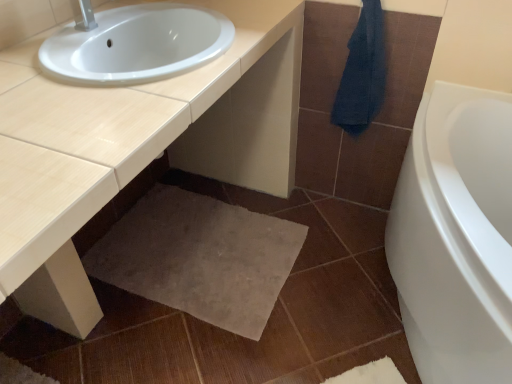
Image resolution: width=512 pixels, height=384 pixels. I want to click on vacant space that is in between beige glossy countertop at center and beige carpet at lower center, so click(x=229, y=330).